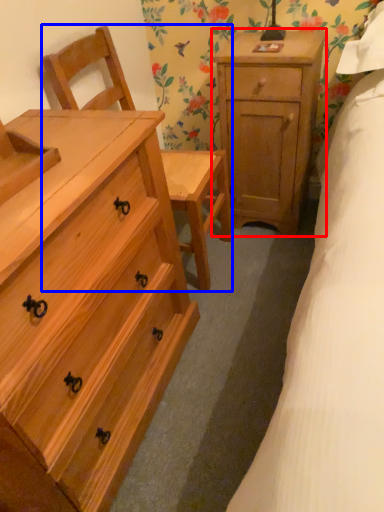
Question: Which of the following is the farthest to the observer, nightstand (highlighted by a red box) or armchair (highlighted by a blue box)?

Choices:
 (A) nightstand
 (B) armchair

Answer: (A)